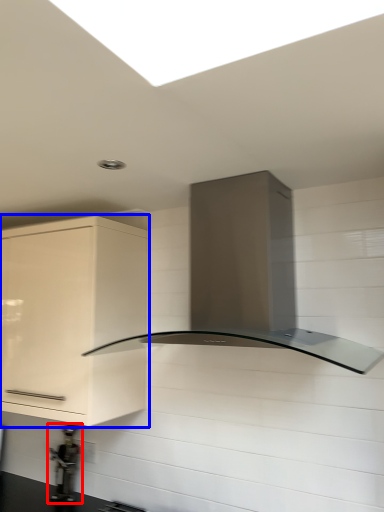
Question: Which of the following is the closest to the observer, appliance (highlighted by a red box) or cabinetry (highlighted by a blue box)?

Choices:
 (A) appliance
 (B) cabinetry

Answer: (B)